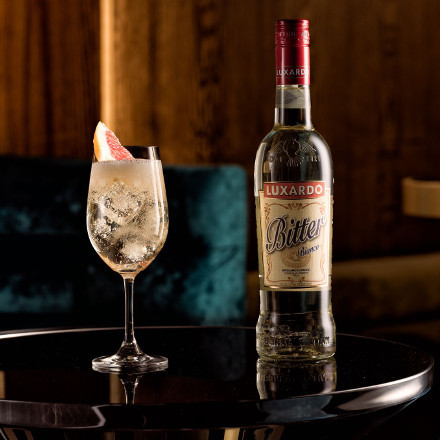
Where is `wooden panelling`? wooden panelling is located at coordinates (184, 63).